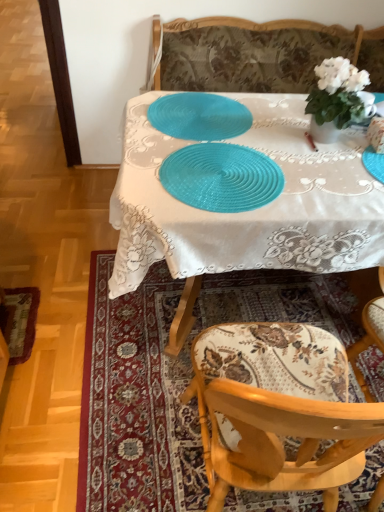
Where is `vacant area to the right of teal plastic placemat at center, which ranks as the first tableware in top-to-bottom order`? This screenshot has width=384, height=512. vacant area to the right of teal plastic placemat at center, which ranks as the first tableware in top-to-bottom order is located at coordinates click(x=289, y=138).